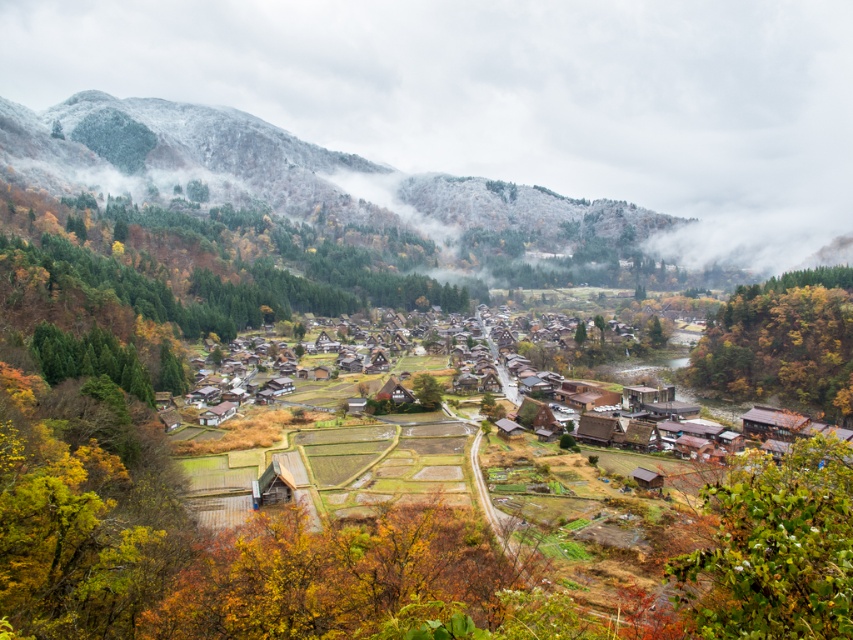
Looking at this image, is snow-covered forest at upper left below autumn leaves at right?

Actually, snow-covered forest at upper left is above autumn leaves at right.

Does snow-covered forest at upper left have a greater width compared to autumn leaves at right?

Yes, snow-covered forest at upper left is wider than autumn leaves at right.

Which is behind, point (622, 237) or point (787, 396)?

Point (622, 237)

At what (x,y) coordinates should I click in order to perform the action: click on snow-covered forest at upper left. Please return your answer as a coordinate pair (x, y). Looking at the image, I should click on (283, 172).

Is green leafy tree at lower right positioned at the back of autumn leaves at right?

No, green leafy tree at lower right is in front of autumn leaves at right.

Based on the photo, which of these two, green leafy tree at lower right or autumn leaves at right, stands shorter?

With less height is green leafy tree at lower right.

The height and width of the screenshot is (640, 853). What are the coordinates of `green leafy tree at lower right` in the screenshot? It's located at click(x=776, y=548).

Is the position of snow-covered forest at upper left more distant than that of green leafy tree at lower right?

That is True.

Is snow-covered forest at upper left thinner than green leafy tree at lower right?

Incorrect, snow-covered forest at upper left's width is not less than green leafy tree at lower right's.

In order to click on snow-covered forest at upper left in this screenshot , I will do `click(283, 172)`.